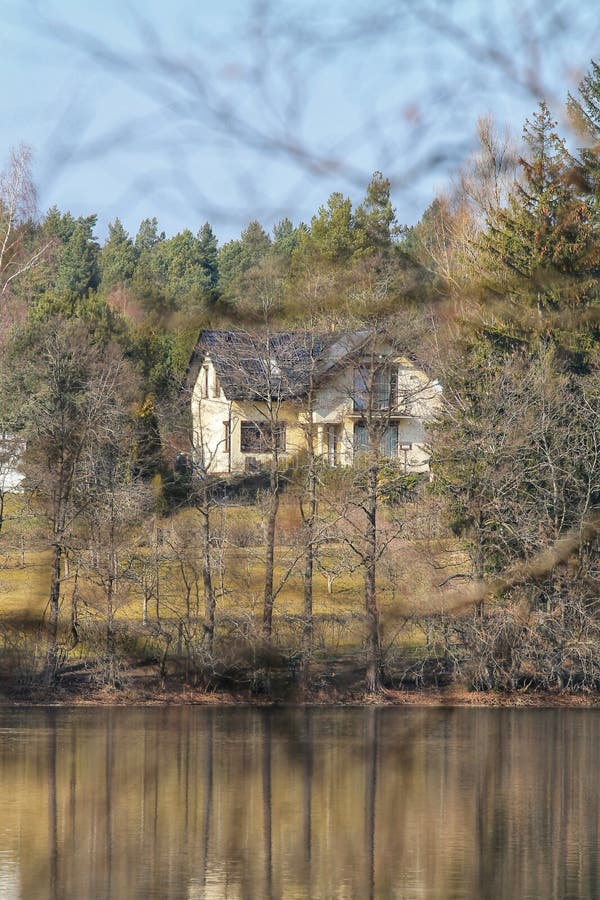
The width and height of the screenshot is (600, 900). Identify the location of windows. (256, 439), (364, 390).